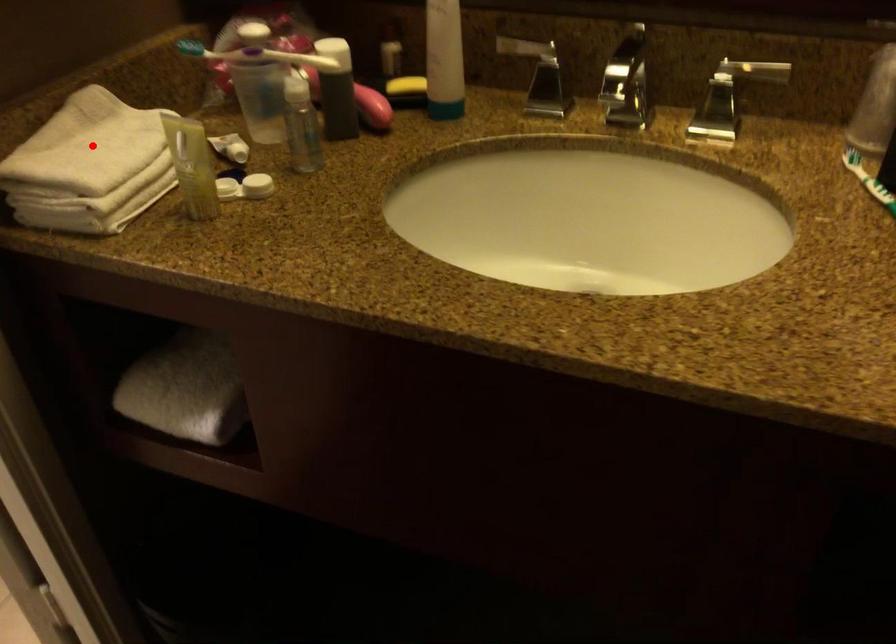
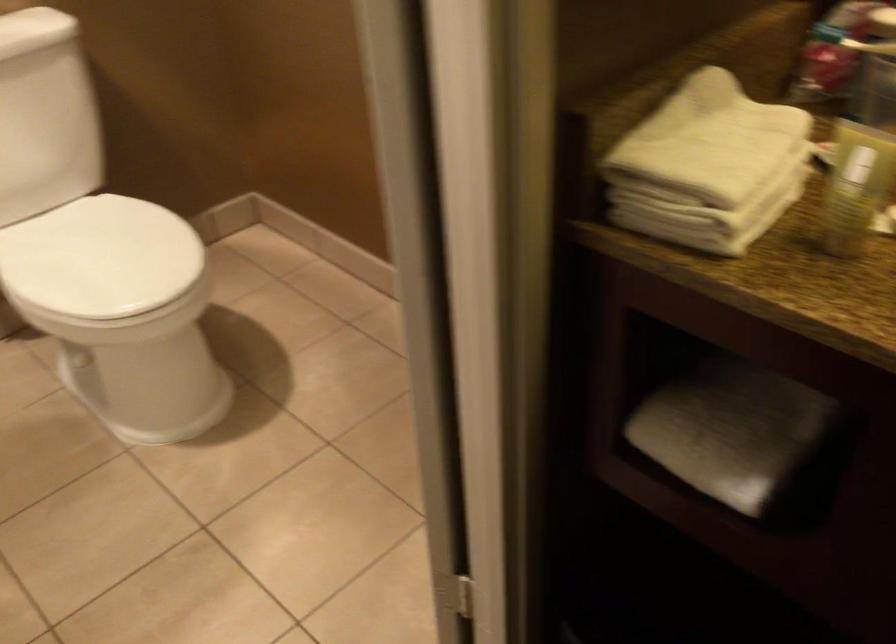
Question: A red point is marked in image1. In image2, is the corresponding 3D point closer to the camera or farther? Reply with the corresponding letter.

Choices:
 (A) The corresponding 3D point is closer.
 (B) The corresponding 3D point is farther.

Answer: (A)